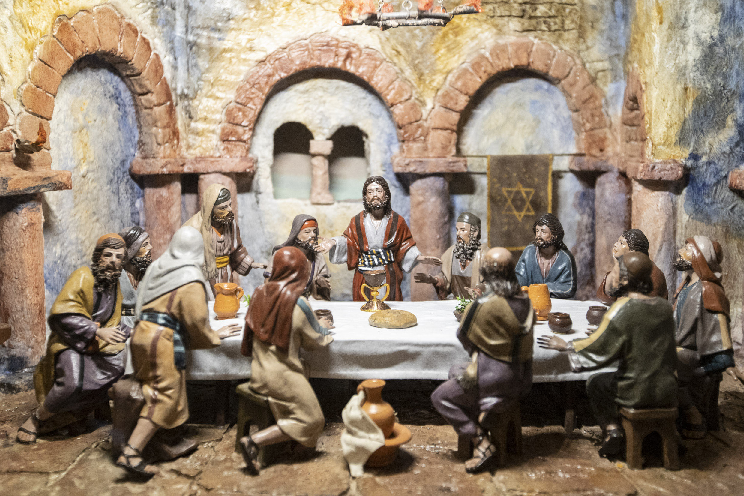
Where is `sculpted hands`? This screenshot has height=496, width=744. sculpted hands is located at coordinates (425, 257), (425, 276), (318, 245), (257, 260), (106, 333), (227, 326), (324, 319), (554, 342).